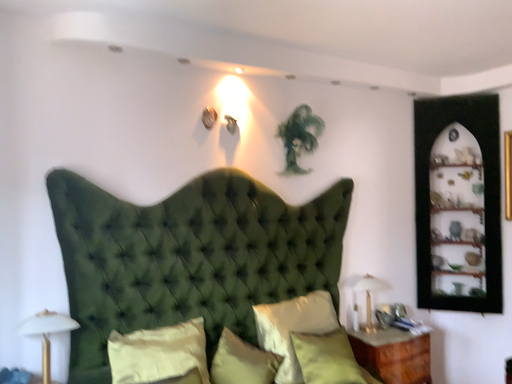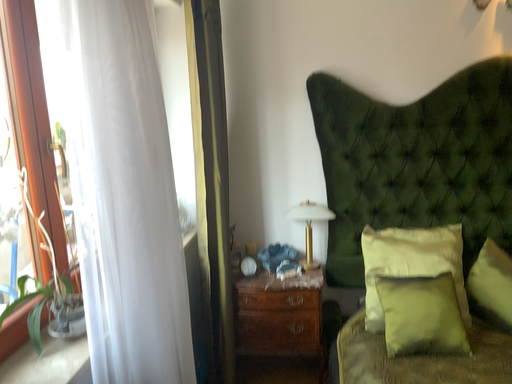
Question: How did the camera likely rotate when shooting the video?

Choices:
 (A) rotated downward
 (B) rotated upward

Answer: (A)